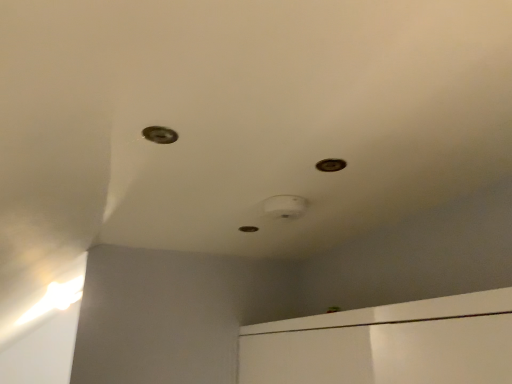
Question: Is metallic circular hole at upper center, which is the 3th hole in left-to-right order, at the right side of metallic hole at center, which is the first hole from bottom to top?

Choices:
 (A) yes
 (B) no

Answer: (A)

Question: Considering the relative sizes of metallic circular hole at upper center, which is the second hole from bottom to top, and metallic hole at center, which is the first hole in back-to-front order, in the image provided, is metallic circular hole at upper center, which is the second hole from bottom to top, taller than metallic hole at center, which is the first hole in back-to-front order,?

Choices:
 (A) yes
 (B) no

Answer: (B)

Question: Is metallic circular hole at upper center, which is the second hole from bottom to top, to the left of metallic hole at center, which appears as the third hole when viewed from the front, from the viewer's perspective?

Choices:
 (A) yes
 (B) no

Answer: (B)

Question: Considering the relative positions of metallic circular hole at upper center, arranged as the 2th hole when viewed from the back, and metallic hole at center, which is the first hole in back-to-front order, in the image provided, is metallic circular hole at upper center, arranged as the 2th hole when viewed from the back, behind metallic hole at center, which is the first hole in back-to-front order,?

Choices:
 (A) yes
 (B) no

Answer: (B)

Question: Considering the relative sizes of metallic circular hole at upper center, the 1th hole in the right-to-left sequence, and metallic hole at center, which appears as the second hole when viewed from the left, in the image provided, is metallic circular hole at upper center, the 1th hole in the right-to-left sequence, thinner than metallic hole at center, which appears as the second hole when viewed from the left,?

Choices:
 (A) no
 (B) yes

Answer: (B)

Question: Considering their positions, is metallic circular hole at upper left, which ranks as the 1th hole in front-to-back order, located in front of or behind metallic hole at center, which is the first hole from bottom to top?

Choices:
 (A) behind
 (B) front

Answer: (B)

Question: From the image's perspective, is metallic circular hole at upper left, the 3th hole in the back-to-front sequence, above or below metallic hole at center, which appears as the third hole when viewed from the top?

Choices:
 (A) above
 (B) below

Answer: (A)

Question: In terms of size, does metallic circular hole at upper left, the 3th hole in the bottom-to-top sequence, appear bigger or smaller than metallic hole at center, which appears as the second hole when viewed from the left?

Choices:
 (A) small
 (B) big

Answer: (A)

Question: Is metallic circular hole at upper left, the 3th hole in the bottom-to-top sequence, inside the boundaries of metallic hole at center, which appears as the third hole when viewed from the top, or outside?

Choices:
 (A) inside
 (B) outside

Answer: (B)

Question: Would you say metallic hole at center, which appears as the third hole when viewed from the front, is to the left or to the right of metallic circular hole at upper center, the 1th hole in the right-to-left sequence, in the picture?

Choices:
 (A) right
 (B) left

Answer: (B)

Question: In terms of width, does metallic hole at center, which appears as the third hole when viewed from the front, look wider or thinner when compared to metallic circular hole at upper center, the second hole in the front-to-back sequence?

Choices:
 (A) wide
 (B) thin

Answer: (A)

Question: From a real-world perspective, is metallic hole at center, the second hole when ordered from right to left, above or below metallic circular hole at upper center, the second hole in the front-to-back sequence?

Choices:
 (A) below
 (B) above

Answer: (B)

Question: In terms of height, does metallic hole at center, which is the first hole in back-to-front order, look taller or shorter compared to metallic circular hole at upper center, the second hole in the front-to-back sequence?

Choices:
 (A) short
 (B) tall

Answer: (B)

Question: Does point (333, 168) appear closer or farther from the camera than point (168, 130)?

Choices:
 (A) closer
 (B) farther

Answer: (B)

Question: Is metallic circular hole at upper center, which appears as the 2th hole when viewed from the top, inside the boundaries of metallic circular hole at upper left, the 3th hole in the bottom-to-top sequence, or outside?

Choices:
 (A) inside
 (B) outside

Answer: (B)